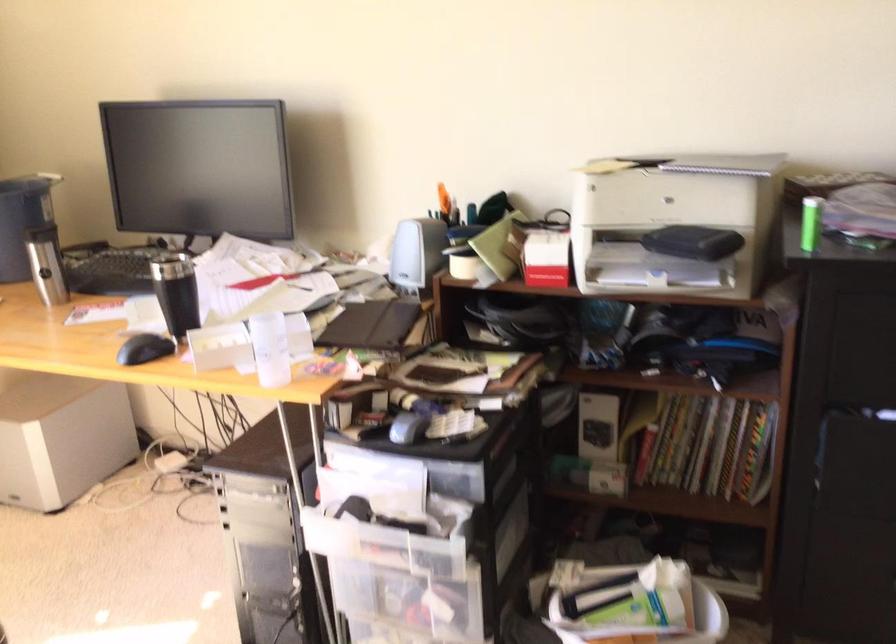
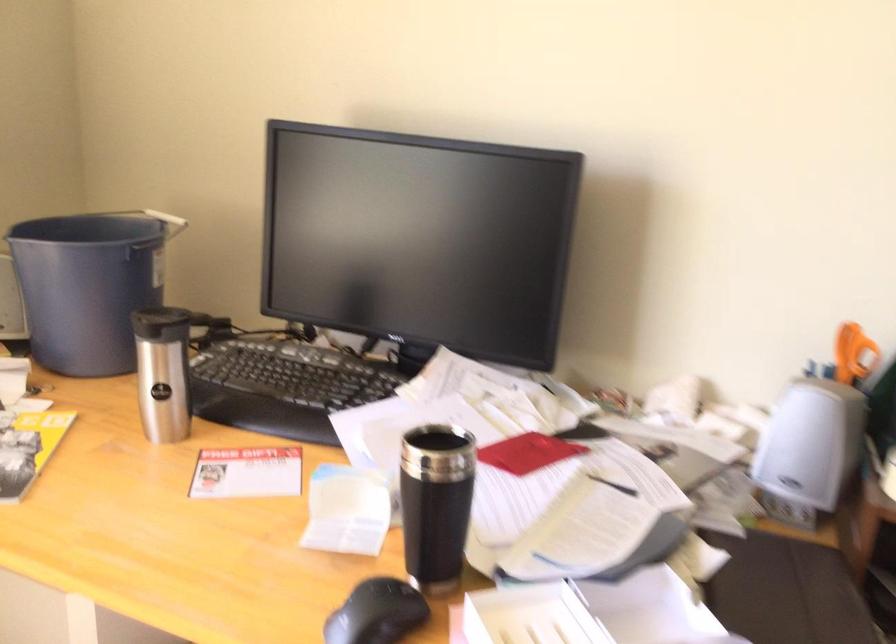
Question: The first image is from the beginning of the video and the second image is from the end. How did the camera likely rotate when shooting the video?

Choices:
 (A) Left
 (B) Right
 (C) Up
 (D) Down

Answer: (C)